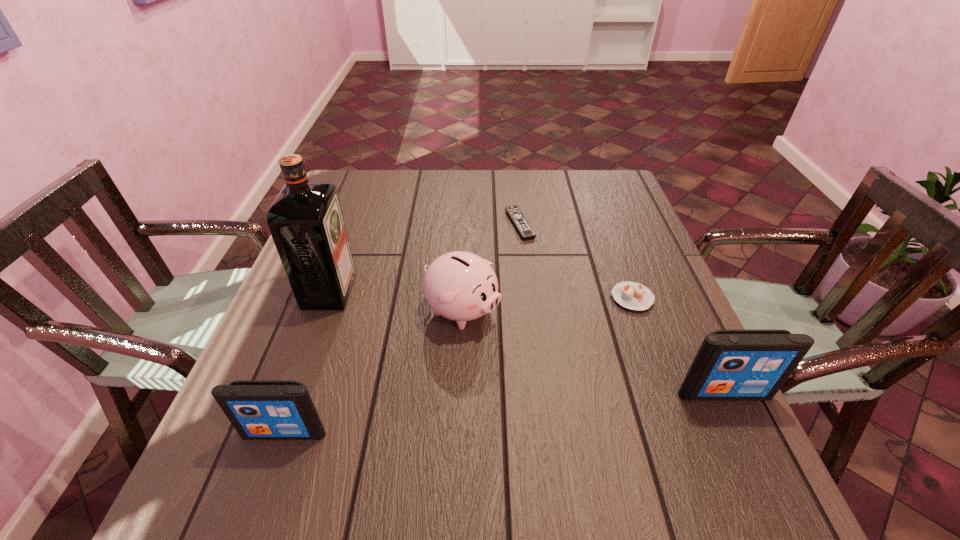
Identify the location of the shorter iPod. (258, 409).

This screenshot has height=540, width=960. Identify the location of the nearest object. (258, 409).

Where is `the fifth farthest object`? The width and height of the screenshot is (960, 540). the fifth farthest object is located at coordinates (731, 365).

Image resolution: width=960 pixels, height=540 pixels. Find the location of `the right iPod`. the right iPod is located at coordinates click(x=731, y=365).

You are a GUI agent. You are given a task and a screenshot of the screen. Output one action in this format:
    pyautogui.click(x=<x>, y=<y>)
    Task: Click on the remote control
    
    Given the screenshot: What is the action you would take?
    pyautogui.click(x=522, y=225)

Where is `the fourth object from left to right`? the fourth object from left to right is located at coordinates (522, 225).

Where is `liquor`? This screenshot has height=540, width=960. liquor is located at coordinates (x=306, y=221).

Find the location of a particular element. This screenshot has height=540, width=960. the fourth object from right to left is located at coordinates (461, 286).

Locate an element on the screen. the second shortest object is located at coordinates (631, 295).

Identify the location of vacant area situated 0.110m on the back of the farthest object. (516, 190).